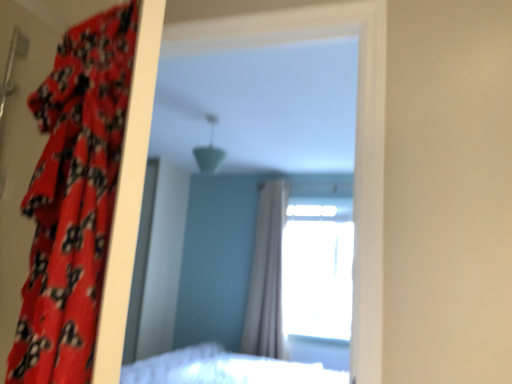
This screenshot has height=384, width=512. What do you see at coordinates (57, 193) in the screenshot?
I see `red floral fabric curtain at left, the first curtain from the left` at bounding box center [57, 193].

The image size is (512, 384). Find the location of `white sheer curtain at center, placed as the second curtain when sorted from left to right`. white sheer curtain at center, placed as the second curtain when sorted from left to right is located at coordinates (267, 276).

Is transparent glass window at upper center far from white sheer curtain at center, positioned as the 1th curtain in back-to-front order?

transparent glass window at upper center is near white sheer curtain at center, positioned as the 1th curtain in back-to-front order, not far away.

Does transparent glass window at upper center have a lesser width compared to white sheer curtain at center, the 2th curtain viewed from the front?

Incorrect, the width of transparent glass window at upper center is not less than that of white sheer curtain at center, the 2th curtain viewed from the front.

Considering the sizes of transparent glass window at upper center and white sheer curtain at center, the 2th curtain viewed from the front, in the image, is transparent glass window at upper center bigger or smaller than white sheer curtain at center, the 2th curtain viewed from the front,?

Clearly, transparent glass window at upper center is larger in size than white sheer curtain at center, the 2th curtain viewed from the front.

Is point (286, 333) behind point (273, 238)?

No, it is in front of (273, 238).

Is matte plastic mirror at center inside or outside of white sheer curtain at center, positioned as the 1th curtain in back-to-front order?

matte plastic mirror at center cannot be found inside white sheer curtain at center, positioned as the 1th curtain in back-to-front order.

Which object is positioned more to the right, matte plastic mirror at center or white sheer curtain at center, placed as the second curtain when sorted from left to right?

white sheer curtain at center, placed as the second curtain when sorted from left to right.

Is matte plastic mirror at center in front of or behind white sheer curtain at center, placed as the second curtain when sorted from left to right, in the image?

matte plastic mirror at center is in front of white sheer curtain at center, placed as the second curtain when sorted from left to right.

Is point (204, 245) closer or farther from the camera than point (243, 351)?

Clearly, point (204, 245) is more distant from the camera than point (243, 351).

Is transparent glass window at upper center next to red floral fabric curtain at left, the first curtain from the left, and touching it?

transparent glass window at upper center and red floral fabric curtain at left, the first curtain from the left, are not in contact.

From the picture: Does transparent glass window at upper center have a lesser height compared to red floral fabric curtain at left, the first curtain from the left?

No.

In the image, is transparent glass window at upper center positioned in front of or behind red floral fabric curtain at left, the 1th curtain viewed from the front?

Visually, transparent glass window at upper center is located behind red floral fabric curtain at left, the 1th curtain viewed from the front.

Is transparent glass window at upper center in front of or behind matte plastic mirror at center in the image?

transparent glass window at upper center is behind matte plastic mirror at center.

In terms of height, does transparent glass window at upper center look taller or shorter compared to matte plastic mirror at center?

Considering their sizes, transparent glass window at upper center has more height than matte plastic mirror at center.

Is transparent glass window at upper center not close to matte plastic mirror at center?

They are positioned close to each other.

Which object is wider, transparent glass window at upper center or matte plastic mirror at center?

transparent glass window at upper center is wider.

In order to click on curtain below the transparent glass window at upper center (from a real-world perspective) in this screenshot , I will do `click(267, 276)`.

Considering the relative sizes of white sheer curtain at center, arranged as the 1th curtain when viewed from the right, and transparent glass window at upper center in the image provided, is white sheer curtain at center, arranged as the 1th curtain when viewed from the right, taller than transparent glass window at upper center?

Correct, white sheer curtain at center, arranged as the 1th curtain when viewed from the right, is much taller as transparent glass window at upper center.

Does white sheer curtain at center, positioned as the 1th curtain in back-to-front order, have a larger size compared to transparent glass window at upper center?

Actually, white sheer curtain at center, positioned as the 1th curtain in back-to-front order, might be smaller than transparent glass window at upper center.

Between point (258, 251) and point (336, 272), which one is positioned in front?

Positioned in front is point (258, 251).

Find the location of a particular element. This screenshot has height=384, width=512. curtain in front of the white sheer curtain at center, the 2th curtain viewed from the front is located at coordinates (57, 193).

Which of these two, white sheer curtain at center, the 2th curtain viewed from the front, or red floral fabric curtain at left, the 2th curtain positioned from the back, is wider?

red floral fabric curtain at left, the 2th curtain positioned from the back.

Consider the image. Which of these two, white sheer curtain at center, placed as the second curtain when sorted from left to right, or red floral fabric curtain at left, the 2th curtain positioned from the back, is smaller?

With smaller size is red floral fabric curtain at left, the 2th curtain positioned from the back.

Is matte plastic mirror at center positioned with its back to transparent glass window at upper center?

Correct, matte plastic mirror at center is looking away from transparent glass window at upper center.

Considering the relative sizes of matte plastic mirror at center and transparent glass window at upper center in the image provided, is matte plastic mirror at center bigger than transparent glass window at upper center?

Actually, matte plastic mirror at center might be smaller than transparent glass window at upper center.

Is matte plastic mirror at center in front of transparent glass window at upper center?

Yes, it is in front of transparent glass window at upper center.

In the image, there is a white sheer curtain at center, placed as the second curtain when sorted from left to right. Identify the location of window above it (from the image's perspective). Image resolution: width=512 pixels, height=384 pixels. (318, 267).

This screenshot has width=512, height=384. I want to click on curtain on the right of matte plastic mirror at center, so click(267, 276).

Estimate the real-world distances between objects in this image. Which object is closer to transparent glass window at upper center, matte plastic mirror at center or white sheer curtain at center, placed as the second curtain when sorted from left to right?

white sheer curtain at center, placed as the second curtain when sorted from left to right, lies closer to transparent glass window at upper center than the other object.

Looking at the image, which one is located further to transparent glass window at upper center, white sheer curtain at center, arranged as the 1th curtain when viewed from the right, or red floral fabric curtain at left, the 1th curtain viewed from the front?

red floral fabric curtain at left, the 1th curtain viewed from the front, is positioned further to the anchor transparent glass window at upper center.

Looking at the image, which one is located closer to white sheer curtain at center, positioned as the 1th curtain in back-to-front order, transparent glass window at upper center or red floral fabric curtain at left, the first curtain from the left?

transparent glass window at upper center lies closer to white sheer curtain at center, positioned as the 1th curtain in back-to-front order, than the other object.

Considering their positions, is red floral fabric curtain at left, the 1th curtain viewed from the front, positioned further to matte plastic mirror at center than transparent glass window at upper center?

Among the two, red floral fabric curtain at left, the 1th curtain viewed from the front, is located further to matte plastic mirror at center.

When comparing their distances from red floral fabric curtain at left, placed as the second curtain when sorted from right to left, does matte plastic mirror at center or transparent glass window at upper center seem closer?

matte plastic mirror at center lies closer to red floral fabric curtain at left, placed as the second curtain when sorted from right to left, than the other object.

From the image, which object appears to be nearer to transparent glass window at upper center, red floral fabric curtain at left, placed as the second curtain when sorted from right to left, or matte plastic mirror at center?

Based on the image, matte plastic mirror at center appears to be nearer to transparent glass window at upper center.

Considering their positions, is white sheer curtain at center, placed as the second curtain when sorted from left to right, positioned further to red floral fabric curtain at left, the 1th curtain viewed from the front, than matte plastic mirror at center?

white sheer curtain at center, placed as the second curtain when sorted from left to right, lies further to red floral fabric curtain at left, the 1th curtain viewed from the front, than the other object.

Considering their positions, is transparent glass window at upper center positioned closer to matte plastic mirror at center than white sheer curtain at center, arranged as the 1th curtain when viewed from the right?

white sheer curtain at center, arranged as the 1th curtain when viewed from the right, is positioned closer to the anchor matte plastic mirror at center.

I want to click on mirror between red floral fabric curtain at left, placed as the second curtain when sorted from right to left, and white sheer curtain at center, positioned as the 1th curtain in back-to-front order, from front to back, so click(261, 107).

Identify the location of mirror positioned between red floral fabric curtain at left, placed as the second curtain when sorted from right to left, and transparent glass window at upper center from near to far. (261, 107).

The height and width of the screenshot is (384, 512). Identify the location of curtain between red floral fabric curtain at left, the 2th curtain positioned from the back, and transparent glass window at upper center in the front-back direction. (267, 276).

You are a GUI agent. You are given a task and a screenshot of the screen. Output one action in this format:
    pyautogui.click(x=<x>, y=<y>)
    Task: Click on the curtain between matte plastic mirror at center and transparent glass window at upper center along the z-axis
    This screenshot has height=384, width=512.
    Given the screenshot: What is the action you would take?
    pyautogui.click(x=267, y=276)